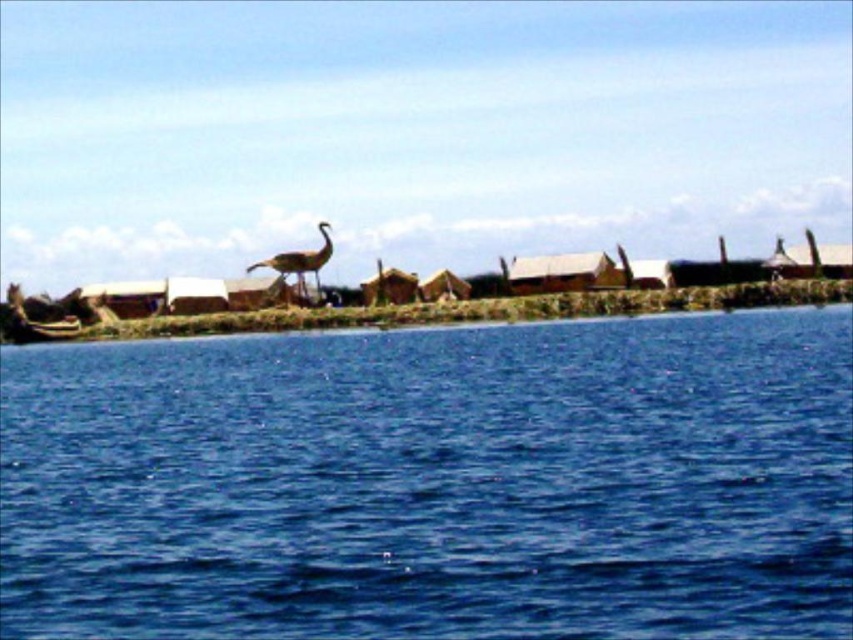
Is point (669, 604) behind point (317, 227)?

No, (669, 604) is closer to viewer.

The image size is (853, 640). Identify the location of blue water at center. (434, 481).

Find the location of `blue water at center`. blue water at center is located at coordinates (434, 481).